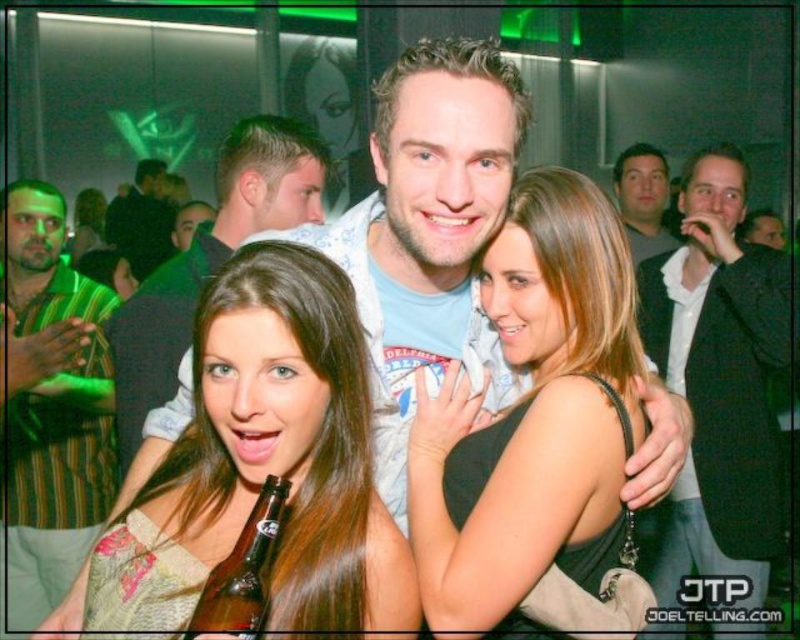
You are standing in the nightclub scene and want to move closer to the two points marked in the image. Which point, point (248, 225) or point (641, 241), would you reach first if you walk straight towards them?

Point (248, 225) is closer to the camera than point (641, 241), so you would reach point (248, 225) first.

You are a photographer at the event and want to capture a photo of both the matte blue shirt at center and the dark suit jacket at upper right in the same frame. Based on their positions, will you need to adjust your camera angle upwards or downwards to include both?

The matte blue shirt at center is positioned under the dark suit jacket at upper right, so you will need to adjust your camera angle upwards to include both.